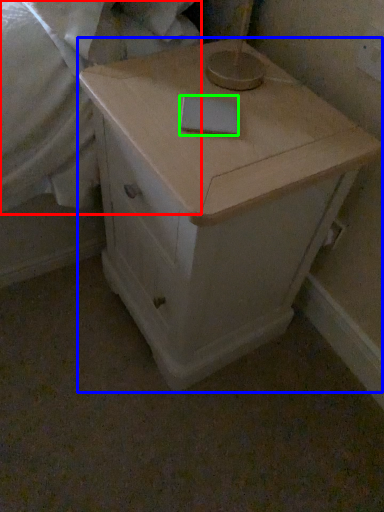
Question: Based on their relative distances, which object is nearer to sheet (highlighted by a red box)? Choose from chest of drawers (highlighted by a blue box) and notepad (highlighted by a green box).

Choices:
 (A) chest of drawers
 (B) notepad

Answer: (A)